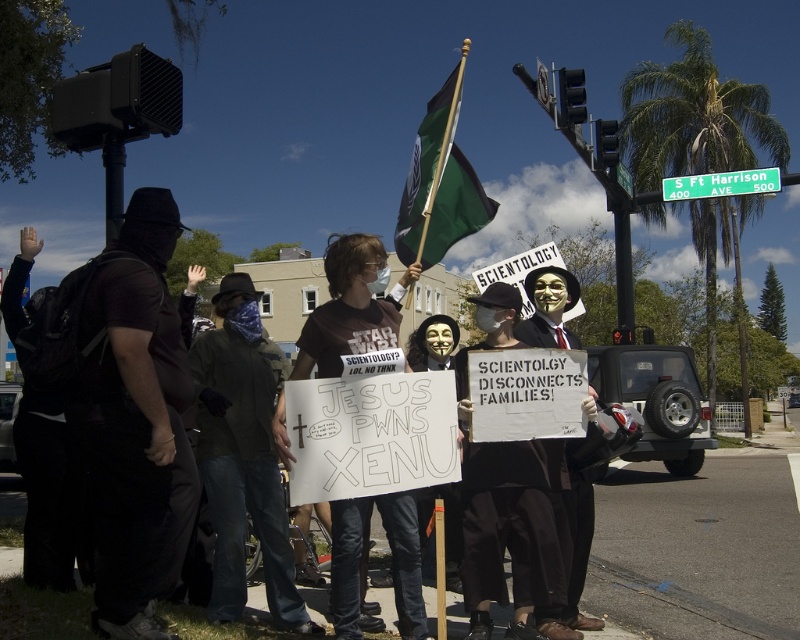
Which is above, green fabric flag at center or green plastic street sign at upper center?

Positioned higher is green plastic street sign at upper center.

Between point (420, 164) and point (780, 182), which one is positioned behind?

The point (780, 182) is behind.

Which is in front, point (432, 176) or point (737, 192)?

Point (432, 176)

You are a GUI agent. You are given a task and a screenshot of the screen. Output one action in this format:
    pyautogui.click(x=<x>, y=<y>)
    Task: Click on the green fabric flag at center
    The image size is (800, 640).
    Given the screenshot: What is the action you would take?
    pyautogui.click(x=440, y=184)

Based on the photo, does matte black suit at center lie behind green plastic street sign at upper center?

No.

Where is `matte black suit at center`? Image resolution: width=800 pixels, height=640 pixels. matte black suit at center is located at coordinates (568, 545).

Is black matte clothing at left smaller than green fabric flag at center?

Yes, black matte clothing at left is smaller than green fabric flag at center.

Is black matte clothing at left thinner than green fabric flag at center?

Incorrect, black matte clothing at left's width is not less than green fabric flag at center's.

Does point (94, 492) come farther from viewer compared to point (426, 228)?

No, (94, 492) is closer to viewer.

Where is `black matte clothing at left`? black matte clothing at left is located at coordinates (136, 419).